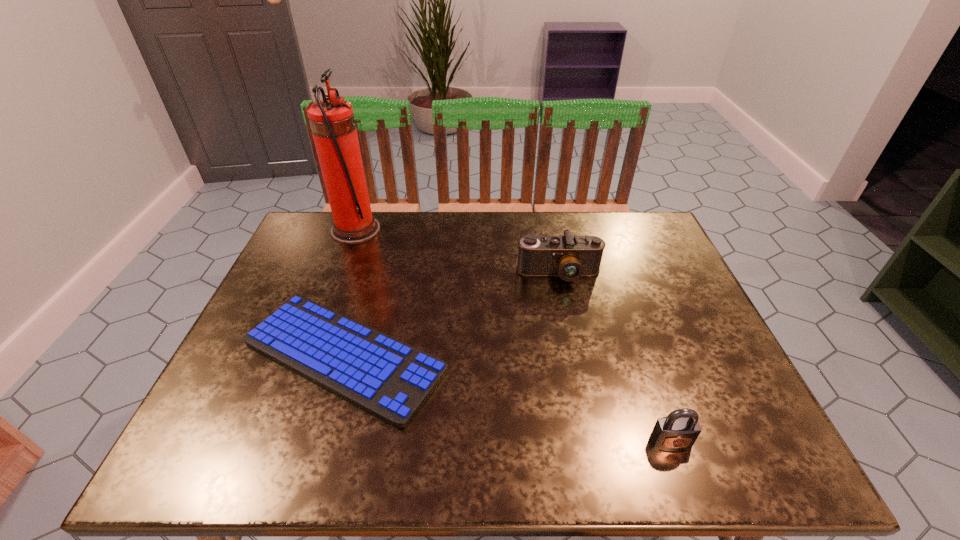
Where is `padlock that is at the near edge`? The height and width of the screenshot is (540, 960). padlock that is at the near edge is located at coordinates (679, 430).

Find the location of `computer keyboard that is positioned at the near edge`. computer keyboard that is positioned at the near edge is located at coordinates (389, 379).

You are a GUI agent. You are given a task and a screenshot of the screen. Output one action in this format:
    pyautogui.click(x=<x>, y=<y>)
    Task: Click on the fire extinguisher that is positioned at the left edge
    Image resolution: width=960 pixels, height=540 pixels.
    Given the screenshot: What is the action you would take?
    pyautogui.click(x=332, y=122)

Where is `computer keyboard that is at the left edge`? computer keyboard that is at the left edge is located at coordinates (389, 379).

You are a GUI agent. You are given a task and a screenshot of the screen. Output one action in this format:
    pyautogui.click(x=<x>, y=<y>)
    Task: Click on the object that is positioned at the right edge
    The height and width of the screenshot is (540, 960).
    Given the screenshot: What is the action you would take?
    pyautogui.click(x=679, y=430)

Locate an element on the screen. The height and width of the screenshot is (540, 960). object situated at the far left corner is located at coordinates (332, 122).

What are the coordinates of `object located in the near left corner section of the desktop` in the screenshot? It's located at (389, 379).

At what (x,y) coordinates should I click in order to perform the action: click on object positioned at the near right corner. Please return your answer as a coordinate pair (x, y). This screenshot has height=540, width=960. Looking at the image, I should click on (679, 430).

Locate an element on the screen. This screenshot has width=960, height=540. free space at the far edge of the desktop is located at coordinates (507, 231).

I want to click on vacant space at the near edge of the desktop, so click(x=349, y=432).